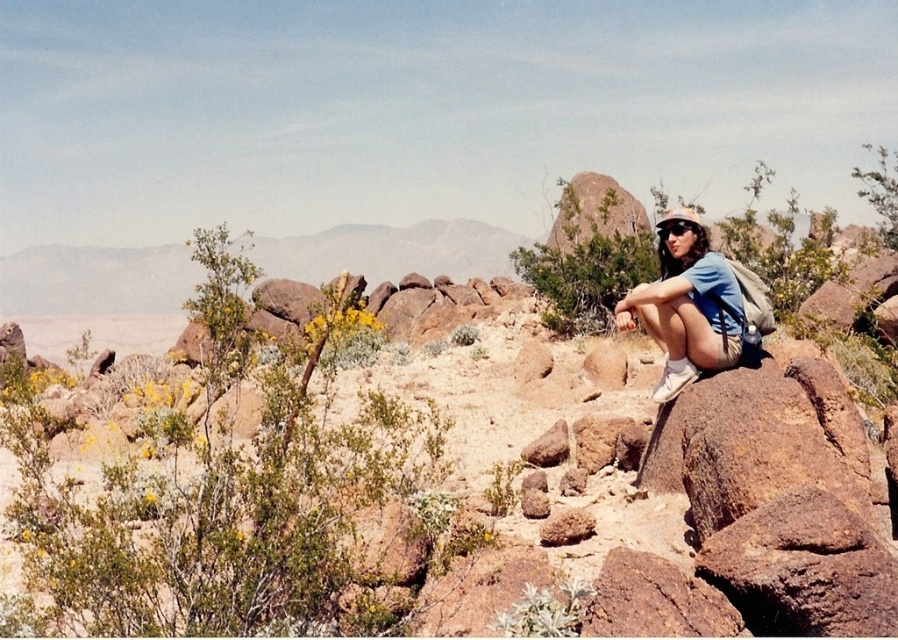
Can you confirm if green leafy bush at center is taller than blue fabric shirt at center?

Indeed, green leafy bush at center has a greater height compared to blue fabric shirt at center.

Is point (600, 294) positioned in front of point (718, 264)?

No, (600, 294) is further to viewer.

Between point (553, 324) and point (690, 381), which one is positioned behind?

Point (553, 324)

Locate an element on the screen. green leafy bush at center is located at coordinates (588, 253).

Who is positioned more to the right, green leafy bush at left or blue fabric shirt at center?

blue fabric shirt at center is more to the right.

Which is above, green leafy bush at left or blue fabric shirt at center?

Positioned higher is green leafy bush at left.

The image size is (898, 640). In order to click on green leafy bush at left in this screenshot , I will do `click(219, 492)`.

Who is higher up, green leafy bush at left or green leafy bush at center?

Positioned higher is green leafy bush at center.

Does point (232, 605) come in front of point (612, 246)?

That is True.

Where is `green leafy bush at left`? The height and width of the screenshot is (640, 898). green leafy bush at left is located at coordinates (219, 492).